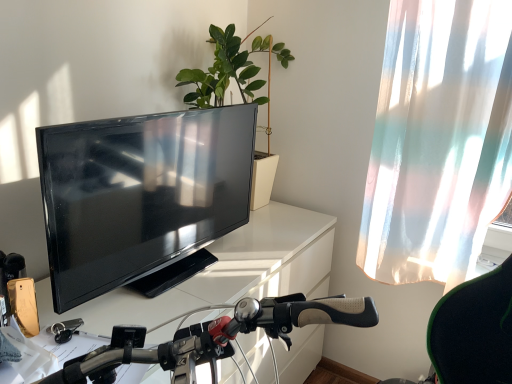
Locate an element on the screen. vacant area that is situated to the right of matte black tv at left is located at coordinates (242, 257).